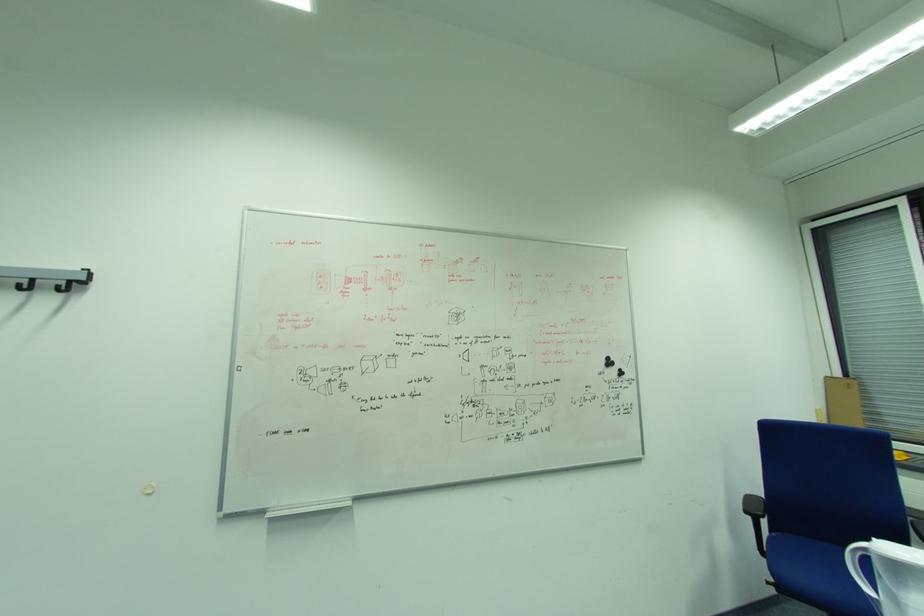
This screenshot has width=924, height=616. Describe the element at coordinates (858, 565) in the screenshot. I see `the white pitcher handle` at that location.